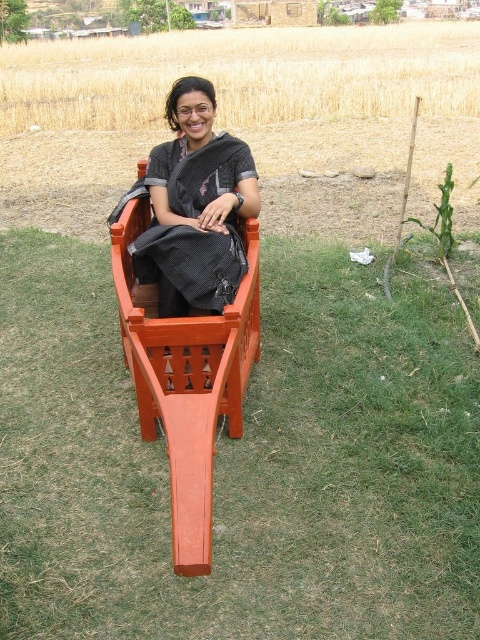
Consider the image. How distant is orange wood chair at center from black woven saree at center?

orange wood chair at center and black woven saree at center are 12.92 inches apart from each other.

Is point (214, 404) behind point (168, 97)?

No, it is not.

Which is behind, point (143, 177) or point (193, 202)?

Positioned behind is point (143, 177).

Image resolution: width=480 pixels, height=640 pixels. I want to click on orange wood chair at center, so tap(187, 378).